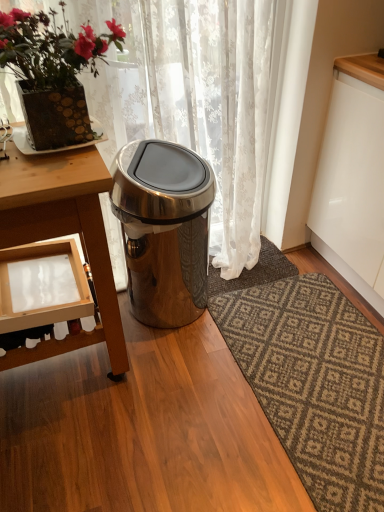
Locate an element on the screen. free spot to the right of wooden table at left is located at coordinates (184, 396).